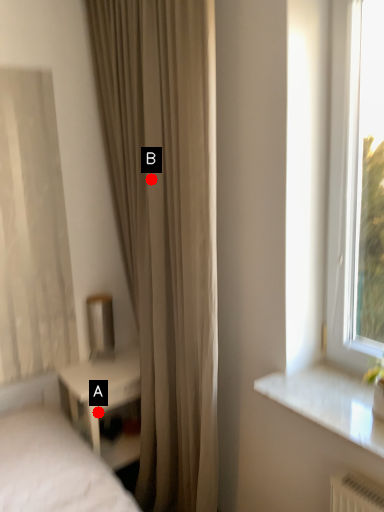
Question: Two points are circled on the image, labeled by A and B beside each circle. Which point is closer to the camera?

Choices:
 (A) A is closer
 (B) B is closer

Answer: (B)